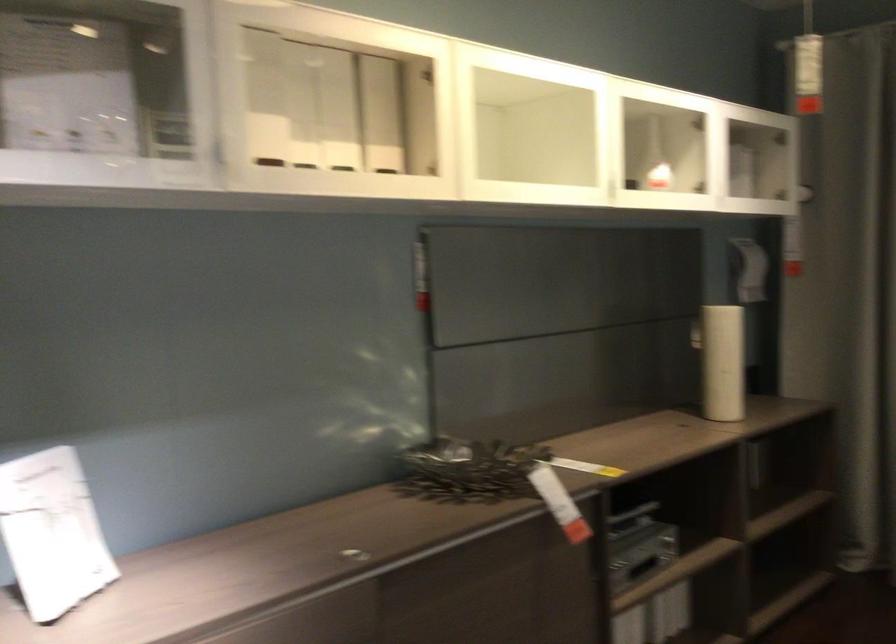
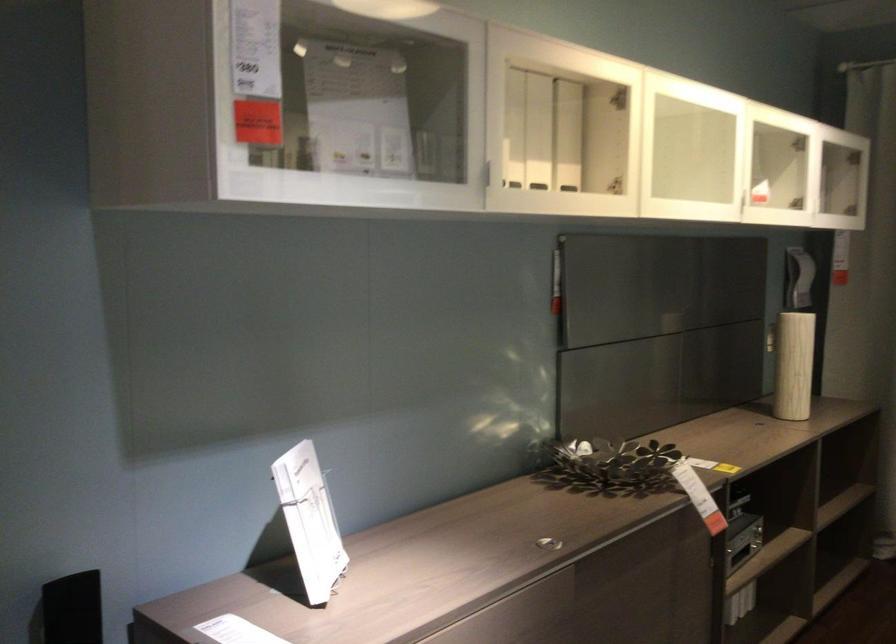
The point at (725,355) is marked in the first image. Where is the corresponding point in the second image?

(794, 365)